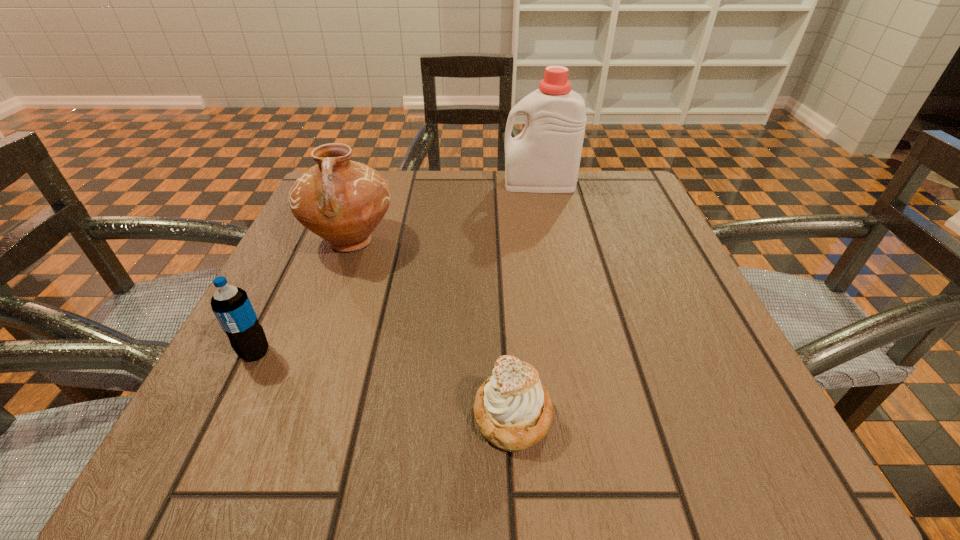
Where is `free location that satisfies the following two spatial constraints: 1. on the side of the second farthest object with the handle; 2. on the right side of the shortest object`? free location that satisfies the following two spatial constraints: 1. on the side of the second farthest object with the handle; 2. on the right side of the shortest object is located at coordinates pyautogui.click(x=287, y=416).

Locate an element on the screen. free space that satisfies the following two spatial constraints: 1. on the handle side of the detergent; 2. on the side of the pottery with the handle is located at coordinates (551, 241).

The height and width of the screenshot is (540, 960). I want to click on free point that satisfies the following two spatial constraints: 1. on the side of the nearest object with the handle; 2. on the right side of the pottery, so click(x=287, y=416).

Where is `vacant position in the image that satisfies the following two spatial constraints: 1. on the handle side of the farthest object; 2. on the side of the second tallest object with the handle`? The image size is (960, 540). vacant position in the image that satisfies the following two spatial constraints: 1. on the handle side of the farthest object; 2. on the side of the second tallest object with the handle is located at coordinates (551, 241).